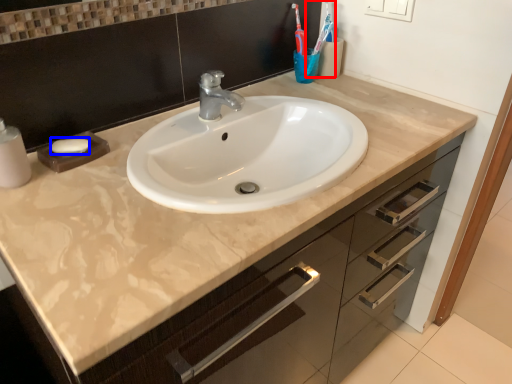
Question: Among these objects, which one is nearest to the camera, toothbrush (highlighted by a red box) or soap (highlighted by a blue box)?

Choices:
 (A) toothbrush
 (B) soap

Answer: (B)